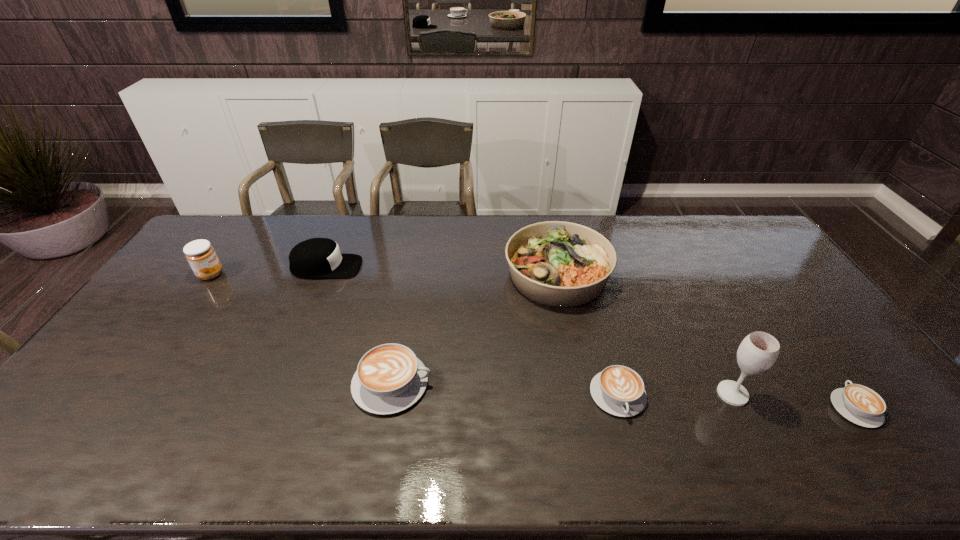
Where is `free space between the tallest cappuccino and the jam`? Image resolution: width=960 pixels, height=540 pixels. free space between the tallest cappuccino and the jam is located at coordinates (301, 329).

Identify the location of vacant space in between the jam and the tallest cappuccino. (x=301, y=329).

Locate an element on the screen. The image size is (960, 540). free space that is in between the cap and the shortest object is located at coordinates (590, 338).

This screenshot has height=540, width=960. What are the coordinates of `free spot between the leftmost cappuccino and the second cappuccino from right to left` in the screenshot? It's located at tap(505, 389).

Locate an element on the screen. This screenshot has height=540, width=960. free point between the second object from left to right and the second tallest cappuccino is located at coordinates (472, 331).

Image resolution: width=960 pixels, height=540 pixels. I want to click on vacant area that lies between the sixth tallest object and the leftmost cappuccino, so click(505, 389).

The height and width of the screenshot is (540, 960). In order to click on unoccupied area between the jam and the wineglass in this screenshot , I will do `click(471, 334)`.

Identify the location of free space between the jam and the sixth tallest object. This screenshot has width=960, height=540. (415, 335).

Find the location of a particular element. This screenshot has width=960, height=540. empty space that is in between the second object from left to right and the tallest cappuccino is located at coordinates (359, 325).

Identify the location of object that stands as the closest to the rightmost object. (758, 351).